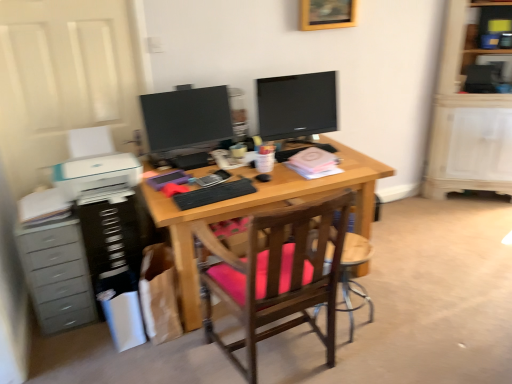
Locate an element on the screen. The height and width of the screenshot is (384, 512). empty space that is ontop of black plastic dresser at left (from a real-world perspective) is located at coordinates (x=101, y=196).